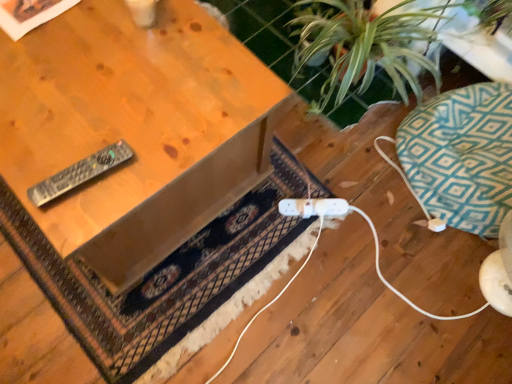
The image size is (512, 384). What do you see at coordinates (163, 273) in the screenshot?
I see `dark brown woven rug at center` at bounding box center [163, 273].

Describe the element at coordinates (313, 207) in the screenshot. I see `white plastic plug at lower center` at that location.

Locate an element on the screen. The width and height of the screenshot is (512, 384). green leafy plant at upper right is located at coordinates (366, 46).

What is the approximate width of black plastic remote at left?

black plastic remote at left is 9.53 inches in width.

The width and height of the screenshot is (512, 384). I want to click on dark brown woven rug at center, so click(x=163, y=273).

From the image's perspective, which object appears higher, black plastic remote at left or teal geometric cushion at right?

teal geometric cushion at right is shown above in the image.

I want to click on remote above the teal geometric cushion at right (from a real-world perspective), so click(x=79, y=173).

Based on the photo, could you tell me if black plastic remote at left is turned towards teal geometric cushion at right?

No, black plastic remote at left is not aimed at teal geometric cushion at right.

Looking at this image, who is smaller, black plastic remote at left or teal geometric cushion at right?

black plastic remote at left is smaller.

Is teal geometric cushion at right shorter than black plastic remote at left?

No.

Is teal geometric cushion at right far away from black plastic remote at left?

teal geometric cushion at right is far away from black plastic remote at left.

From a real-world perspective, between teal geometric cushion at right and black plastic remote at left, who is vertically lower?

In real-world perspective, teal geometric cushion at right is lower.

Which of these two, teal geometric cushion at right or black plastic remote at left, is smaller?

black plastic remote at left is smaller.

From the image's perspective, which is below, teal geometric cushion at right or wooden table at upper left?

teal geometric cushion at right.

Measure the distance from teal geometric cushion at right to wooden table at upper left.

The distance of teal geometric cushion at right from wooden table at upper left is 32.31 inches.

Considering the positions of objects teal geometric cushion at right and wooden table at upper left in the image provided, who is in front, teal geometric cushion at right or wooden table at upper left?

wooden table at upper left is more forward.

Considering the sizes of objects teal geometric cushion at right and wooden table at upper left in the image provided, who is smaller, teal geometric cushion at right or wooden table at upper left?

Smaller between the two is teal geometric cushion at right.

From a real-world perspective, is dark brown woven rug at center under teal geometric cushion at right?

Correct, in the physical world, dark brown woven rug at center is lower than teal geometric cushion at right.

Considering the positions of objects dark brown woven rug at center and teal geometric cushion at right in the image provided, who is more to the left, dark brown woven rug at center or teal geometric cushion at right?

Positioned to the left is dark brown woven rug at center.

Is dark brown woven rug at center inside the boundaries of teal geometric cushion at right, or outside?

The correct answer is: outside.

Does point (276, 245) come closer to viewer compared to point (441, 155)?

Yes, it is in front of point (441, 155).

Considering the positions of point (426, 187) and point (364, 60), is point (426, 187) closer or farther from the camera than point (364, 60)?

Point (426, 187) is positioned closer to the camera compared to point (364, 60).

From the image's perspective, is teal geometric cushion at right below green leafy plant at upper right?

Yes, from the image's perspective, teal geometric cushion at right is below green leafy plant at upper right.

Is teal geometric cushion at right positioned behind green leafy plant at upper right?

That is False.

In the image, there is a teal geometric cushion at right. At what (x,y) coordinates should I click in order to perform the action: click on houseplant above it (from the image's perspective). Please return your answer as a coordinate pair (x, y). The width and height of the screenshot is (512, 384). Looking at the image, I should click on tap(366, 46).

Which of these two, black plastic remote at left or dark brown woven rug at center, is smaller?

black plastic remote at left is smaller.

In the scene shown: Which is more to the right, black plastic remote at left or dark brown woven rug at center?

Positioned to the right is dark brown woven rug at center.

Is black plastic remote at left outside of dark brown woven rug at center?

black plastic remote at left is positioned outside dark brown woven rug at center.

In the scene shown: Does black plastic remote at left have a lesser width compared to dark brown woven rug at center?

Indeed, black plastic remote at left has a lesser width compared to dark brown woven rug at center.

In the scene shown: Does wooden table at upper left have a lesser height compared to green leafy plant at upper right?

No.

Looking at this image, is wooden table at upper left completely or partially outside of green leafy plant at upper right?

Yes, wooden table at upper left is located beyond the bounds of green leafy plant at upper right.

Which is behind, point (71, 71) or point (406, 94)?

Positioned behind is point (406, 94).

What are the coordinates of `swivel chair that appears behind the black plastic remote at left` in the screenshot? It's located at (461, 156).

Identify the location of swivel chair below the black plastic remote at left (from a real-world perspective). Image resolution: width=512 pixels, height=384 pixels. (461, 156).

Which object lies nearer to the anchor point teal geometric cushion at right, black plastic remote at left or wooden table at upper left?

wooden table at upper left is positioned closer to the anchor teal geometric cushion at right.

Looking at the image, which one is located further to dark brown woven rug at center, green leafy plant at upper right or teal geometric cushion at right?

teal geometric cushion at right is positioned further to the anchor dark brown woven rug at center.

Which object lies further to the anchor point black plastic remote at left, teal geometric cushion at right or white plastic plug at lower center?

Based on the image, teal geometric cushion at right appears to be further to black plastic remote at left.

Estimate the real-world distances between objects in this image. Which object is further from wooden table at upper left, dark brown woven rug at center or teal geometric cushion at right?

Based on the image, teal geometric cushion at right appears to be further to wooden table at upper left.

Considering their positions, is black plastic remote at left positioned further to dark brown woven rug at center than green leafy plant at upper right?

green leafy plant at upper right lies further to dark brown woven rug at center than the other object.

From the image, which object appears to be nearer to black plastic remote at left, white plastic plug at lower center or dark brown woven rug at center?

The object closer to black plastic remote at left is dark brown woven rug at center.

Which object lies nearer to the anchor point teal geometric cushion at right, black plastic remote at left or green leafy plant at upper right?

Based on the image, green leafy plant at upper right appears to be nearer to teal geometric cushion at right.

Looking at the image, which one is located closer to dark brown woven rug at center, teal geometric cushion at right or green leafy plant at upper right?

The object closer to dark brown woven rug at center is green leafy plant at upper right.

Find the location of a particular element. remote between wooden table at upper left and green leafy plant at upper right from left to right is located at coordinates (79, 173).

You are a GUI agent. You are given a task and a screenshot of the screen. Output one action in this format:
    pyautogui.click(x=<x>, y=<y>)
    Task: Click on the plug between wooden table at upper left and teal geometric cushion at right from left to right
    The image size is (512, 384).
    Given the screenshot: What is the action you would take?
    pyautogui.click(x=313, y=207)

Find the location of a particular element. The image size is (512, 384). houseplant situated between dark brown woven rug at center and teal geometric cushion at right from left to right is located at coordinates (366, 46).

The height and width of the screenshot is (384, 512). Identify the location of plug located between dark brown woven rug at center and green leafy plant at upper right in the left-right direction. (313, 207).